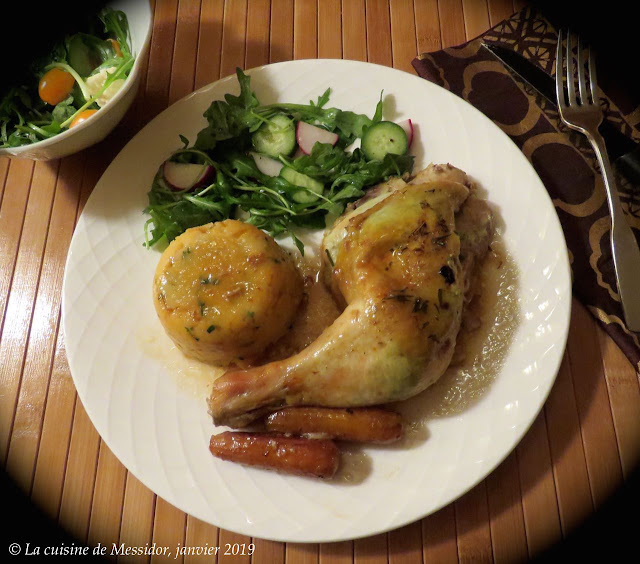
Find the location of `table`. table is located at coordinates (91, 449).